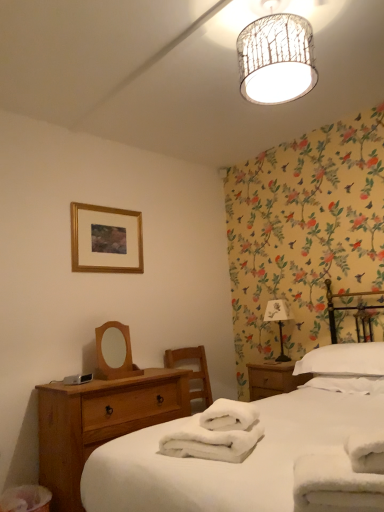
Question: Is white cotton bed at left bigger than white soft pillow at right?

Choices:
 (A) no
 (B) yes

Answer: (B)

Question: Does white cotton bed at left have a smaller size compared to white soft pillow at right?

Choices:
 (A) yes
 (B) no

Answer: (B)

Question: From the image's perspective, is white cotton bed at left on top of white soft pillow at right?

Choices:
 (A) no
 (B) yes

Answer: (A)

Question: From the image's perspective, is white cotton bed at left beneath white soft pillow at right?

Choices:
 (A) yes
 (B) no

Answer: (A)

Question: Is white cotton bed at left to the left of white soft pillow at right from the viewer's perspective?

Choices:
 (A) yes
 (B) no

Answer: (A)

Question: Is white soft pillow at right bigger or smaller than wooden mirror at left?

Choices:
 (A) small
 (B) big

Answer: (B)

Question: From the image's perspective, relative to wooden mirror at left, is white soft pillow at right above or below?

Choices:
 (A) below
 (B) above

Answer: (A)

Question: From their relative heights in the image, would you say white soft pillow at right is taller or shorter than wooden mirror at left?

Choices:
 (A) short
 (B) tall

Answer: (A)

Question: From a real-world perspective, is white soft pillow at right above or below wooden mirror at left?

Choices:
 (A) above
 (B) below

Answer: (B)

Question: Is white soft pillow at right inside or outside of white soft towel at right, the 1th bath towel when ordered from right to left?

Choices:
 (A) outside
 (B) inside

Answer: (A)

Question: In the image, is white soft pillow at right on the left side or the right side of white soft towel at right, the 1th bath towel when ordered from back to front?

Choices:
 (A) left
 (B) right

Answer: (A)

Question: Is point (334, 346) closer or farther from the camera than point (380, 375)?

Choices:
 (A) farther
 (B) closer

Answer: (A)

Question: Is white soft pillow at right wider or thinner than white soft towel at right, the third bath towel viewed from the front?

Choices:
 (A) wide
 (B) thin

Answer: (A)

Question: Is point (289, 316) closer or farther from the camera than point (349, 458)?

Choices:
 (A) farther
 (B) closer

Answer: (A)

Question: Is white fabric-covered table lamp at right in front of or behind white cotton bed at left in the image?

Choices:
 (A) behind
 (B) front

Answer: (A)